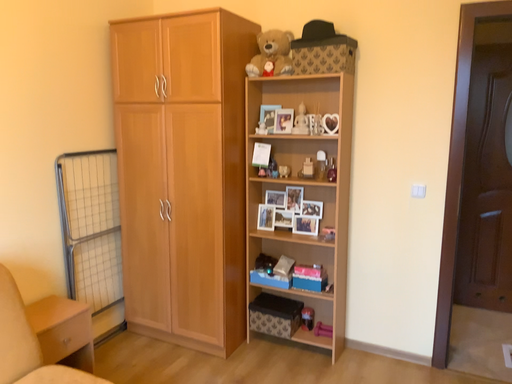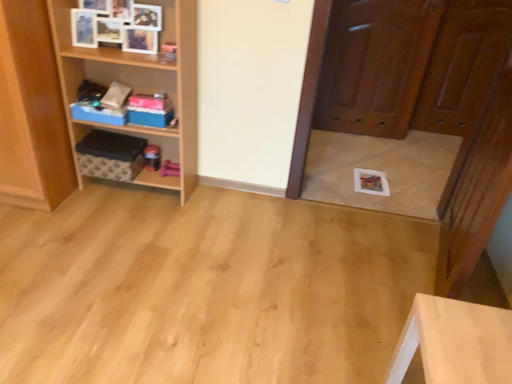
Question: How did the camera likely rotate when shooting the video?

Choices:
 (A) rotated upward
 (B) rotated downward

Answer: (B)